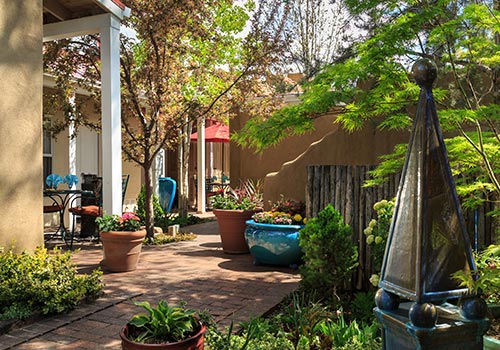
You are a GUI agent. You are given a task and a screenshot of the screen. Output one action in this format:
    pyautogui.click(x=<x>, y=<y>)
    Task: Click on the chair
    The width and height of the screenshot is (500, 350).
    Given the screenshot: What is the action you would take?
    pyautogui.click(x=98, y=206)